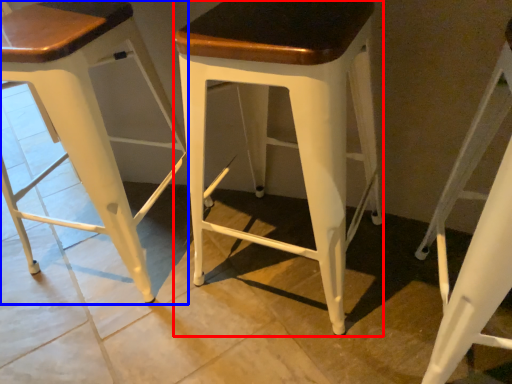
Question: Which of the following is the closest to the observer, stool (highlighted by a red box) or stool (highlighted by a blue box)?

Choices:
 (A) stool
 (B) stool

Answer: (A)